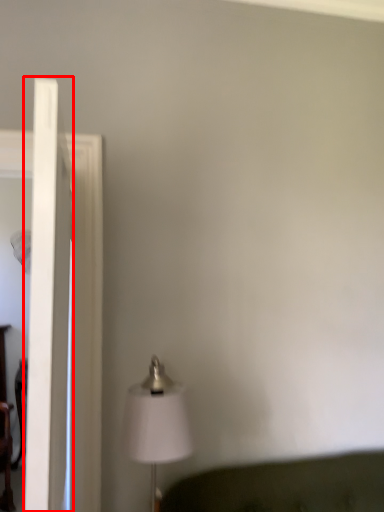
Question: Considering the relative positions of glass door (annotated by the red box) and lamp in the image provided, where is glass door (annotated by the red box) located with respect to the staircase?

Choices:
 (A) right
 (B) left

Answer: (B)